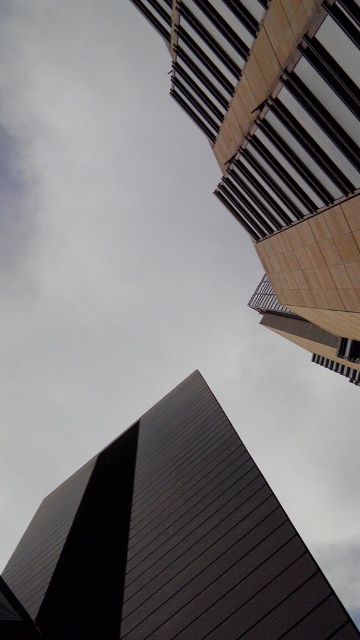
Who is higher up, dark gray metallic tower at lower center or smooth beige building at upper right?

Positioned higher is smooth beige building at upper right.

Is dark gray metallic tower at lower center bigger than smooth beige building at upper right?

Actually, dark gray metallic tower at lower center might be smaller than smooth beige building at upper right.

Is point (339, 624) positioned after point (339, 346)?

No, it is not.

The height and width of the screenshot is (640, 360). Identify the location of dark gray metallic tower at lower center. (172, 541).